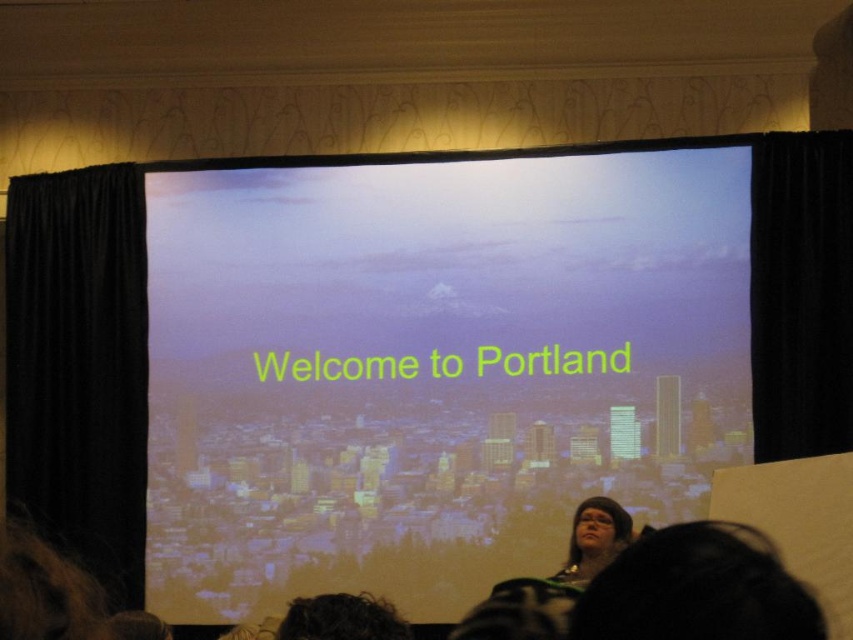
Question: Is black velvet curtain at right to the right of black hair at lower right from the viewer's perspective?

Choices:
 (A) no
 (B) yes

Answer: (B)

Question: Can you confirm if black velvet curtain at left is positioned to the right of black hair at lower right?

Choices:
 (A) yes
 (B) no

Answer: (B)

Question: Considering the real-world distances, which object is closest to the dark curly hair at lower center?

Choices:
 (A) matte screen at center
 (B) matte black glasses at lower center
 (C) black velvet curtain at right

Answer: (B)

Question: Is matte screen at center smaller than black velvet curtain at left?

Choices:
 (A) yes
 (B) no

Answer: (B)

Question: Which point appears closest to the camera in this image?

Choices:
 (A) (117, 218)
 (B) (396, 625)
 (C) (657, 612)

Answer: (C)

Question: Among these points, which one is nearest to the camera?

Choices:
 (A) (743, 556)
 (B) (762, 168)

Answer: (A)